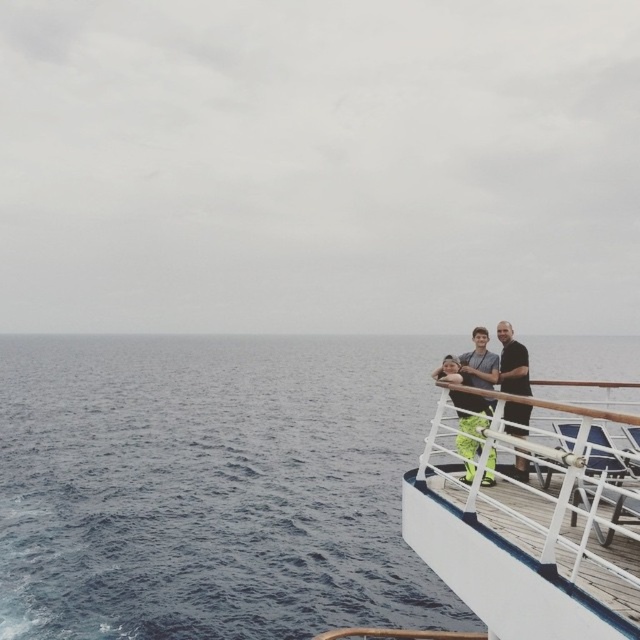
You are standing on the ship deck and want to take a photo of the blue water at lower left. Where should you aim your camera?

You should aim your camera at point (212, 486) to capture the blue water at lower left.

You are a photographer on the ship deck. You want to take a photo of the two people at the right side of the deck. The camera you have can only focus on objects up to 1.5 meters tall. Which of the two people, the dark blue shirt at right or the dark brown leather jacket at right, might have their full height captured in the photo?

The dark blue shirt at right is shorter than the dark brown leather jacket at right. Since the camera can focus up to 1.5 meters, the dark blue shirt at right might have their full height captured if their height is within the camera limit, but the taller dark brown leather jacket at right may exceed the focus range and not be fully captured.

You are standing on the ship and need to place a large cooler that is 1.5 meters wide. Given the white wooden deck at right and the dark brown leather jacket at right, which object can accommodate the cooler in terms of space?

The white wooden deck at right has a larger size compared to the dark brown leather jacket at right, so the cooler can be placed on the white wooden deck at right since it has enough space.